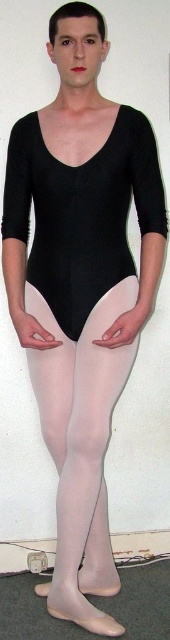
Question: Does black matte leotard at center appear over sheer white tights at center?

Choices:
 (A) no
 (B) yes

Answer: (B)

Question: Which of the following is the farthest from the observer?

Choices:
 (A) (72, 224)
 (B) (80, 488)

Answer: (B)

Question: Is black matte leotard at center positioned behind sheer white tights at center?

Choices:
 (A) no
 (B) yes

Answer: (A)

Question: Which object appears farthest from the camera in this image?

Choices:
 (A) black matte leotard at center
 (B) sheer white tights at center

Answer: (B)

Question: Is black matte leotard at center closer to the viewer compared to sheer white tights at center?

Choices:
 (A) yes
 (B) no

Answer: (A)

Question: Which point is farther to the camera?

Choices:
 (A) (117, 384)
 (B) (80, 320)

Answer: (A)